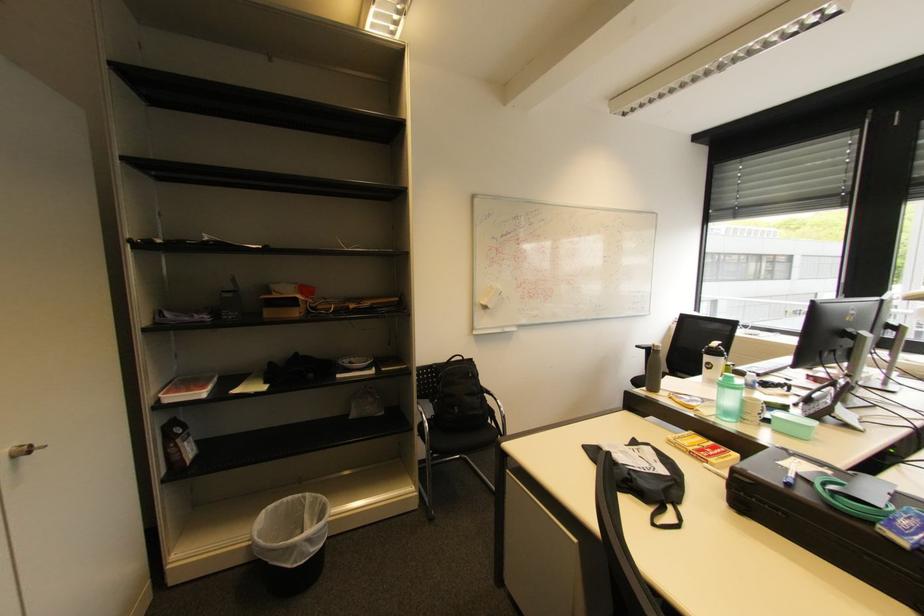
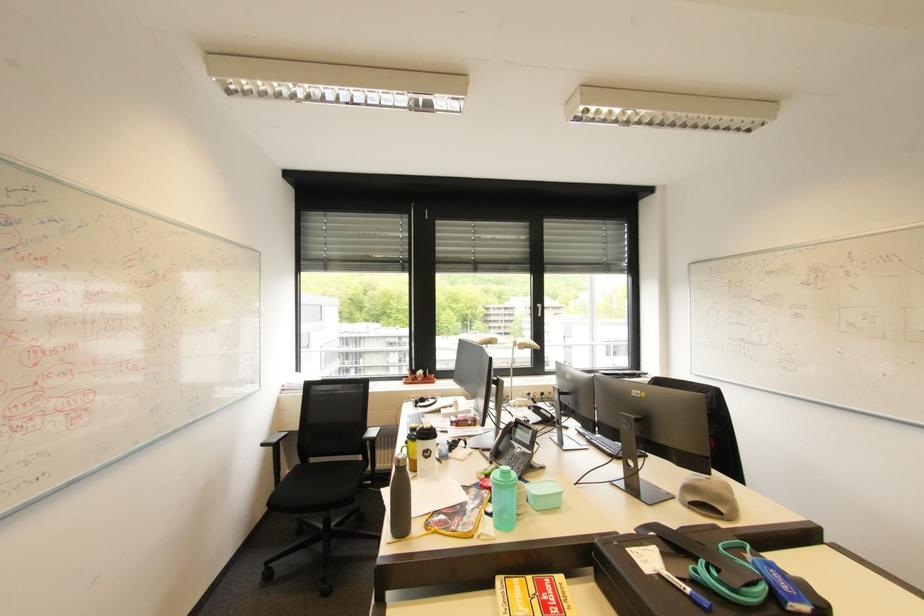
Question: I am providing you with two images of the same scene from different viewpoints. Please identify which objects are invisible in image2.

Choices:
 (A) turquoise water bottle
 (B) silver window handle
 (C) yellow book
 (D) none of these

Answer: (D)